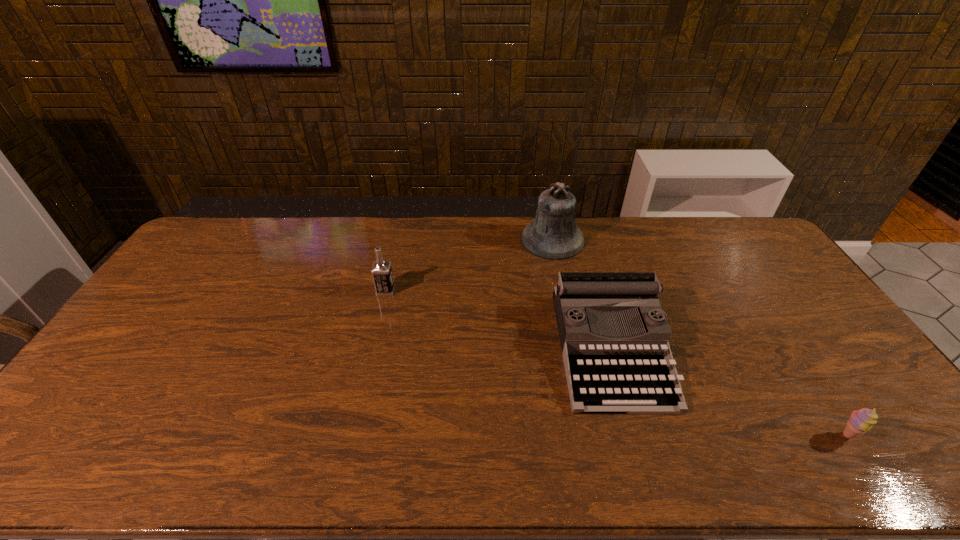
Identify the location of free space between the tallest object and the second farthest object. (469, 265).

The image size is (960, 540). Identify the location of unoccupied position between the bell and the rightmost object. (700, 338).

This screenshot has height=540, width=960. I want to click on free space between the vodka and the second shortest object, so click(498, 320).

I want to click on free space between the vodka and the second nearest object, so click(498, 320).

Find the location of a particular element. The width and height of the screenshot is (960, 540). object that is the nearest to the tallest object is located at coordinates (614, 335).

Point out which object is positioned as the third nearest to the shortest object. Please provide its 2D coordinates. Your answer should be formatted as a tuple, i.e. [(x, y)], where the tuple contains the x and y coordinates of a point satisfying the conditions above.

[(381, 271)]

Find the location of a particular element. free space that satisfies the following two spatial constraints: 1. on the front label of the third shortest object; 2. on the left side of the rightmost object is located at coordinates (352, 435).

Image resolution: width=960 pixels, height=540 pixels. Find the location of `vacant space that satisfies the following two spatial constraints: 1. on the front label of the rightmost object; 2. on the left side of the third nearest object`. vacant space that satisfies the following two spatial constraints: 1. on the front label of the rightmost object; 2. on the left side of the third nearest object is located at coordinates (352, 435).

Identify the location of free space that satisfies the following two spatial constraints: 1. on the typing side of the third farthest object; 2. on the right side of the shortest object. The height and width of the screenshot is (540, 960). tap(636, 435).

Find the location of a particular element. The width and height of the screenshot is (960, 540). free space in the image that satisfies the following two spatial constraints: 1. on the typing side of the third tallest object; 2. on the left side of the sherbert is located at coordinates (x=636, y=435).